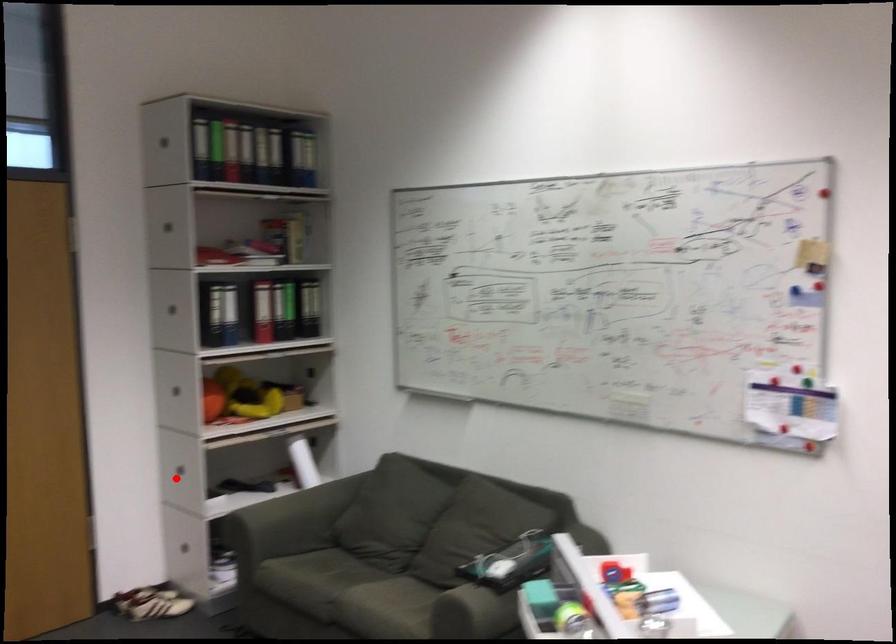
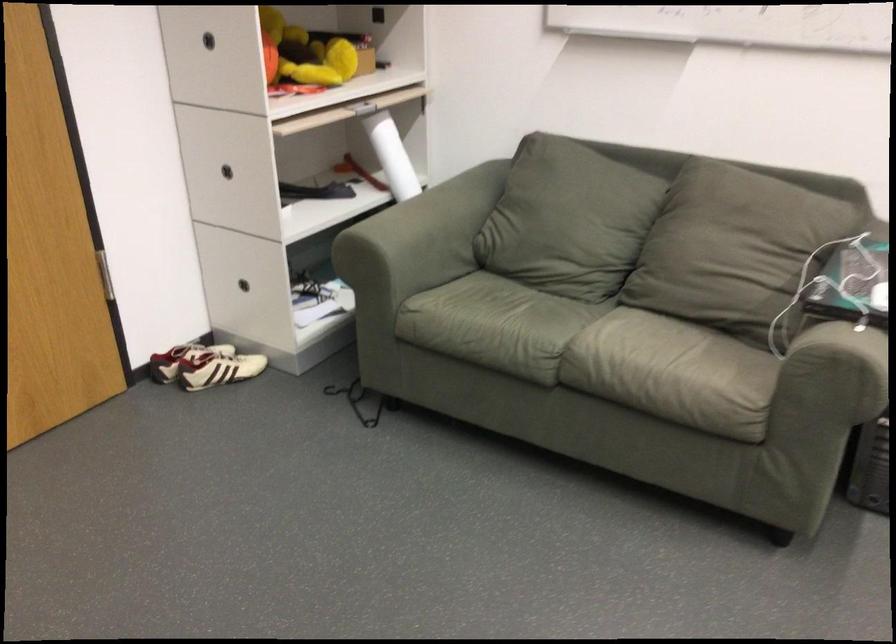
Find the pixel in the second image that matches the highlighted location in the first image.

(227, 171)